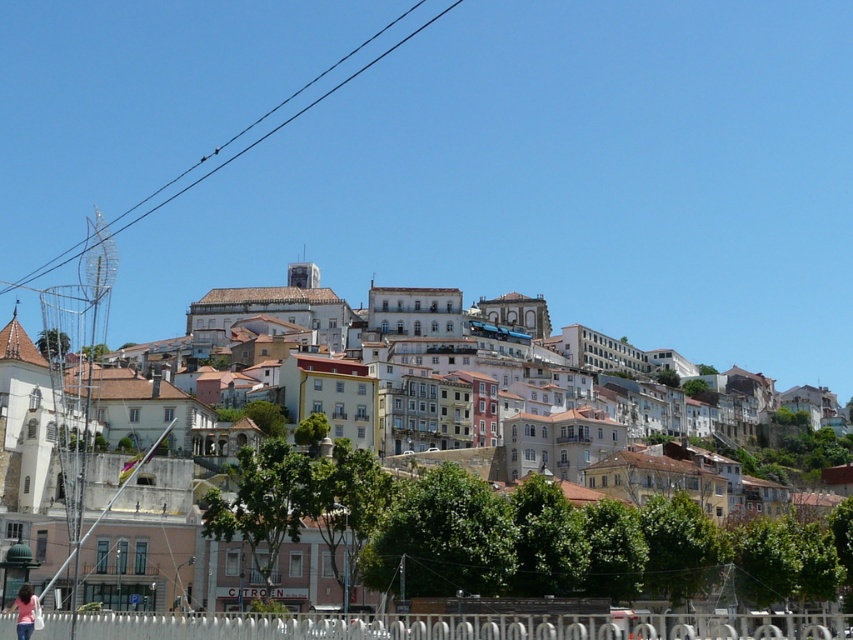
Is white stucco buildings at center to the right of black wire at upper center from the viewer's perspective?

Correct, you'll find white stucco buildings at center to the right of black wire at upper center.

Between white stucco buildings at center and black wire at upper center, which one appears on the left side from the viewer's perspective?

From the viewer's perspective, black wire at upper center appears more on the left side.

Between point (509, 550) and point (219, 168), which one is positioned behind?

The point (219, 168) is behind.

Find the location of a particular element. This screenshot has width=853, height=640. white stucco buildings at center is located at coordinates (519, 534).

Which is below, white stucco buildings at center or light blue jeans at lower left?

light blue jeans at lower left is below.

Who is more forward, (x=555, y=568) or (x=27, y=611)?

Point (x=27, y=611)

Is point (827, 534) positioned after point (22, 589)?

Yes, point (827, 534) is behind point (22, 589).

You are a GUI agent. You are given a task and a screenshot of the screen. Output one action in this format:
    pyautogui.click(x=<x>, y=<y>)
    Task: Click on the white stucco buildings at center
    The width and height of the screenshot is (853, 640).
    Given the screenshot: What is the action you would take?
    pyautogui.click(x=519, y=534)

Is black wire at upper center in front of light blue jeans at lower left?

No.

Who is lower down, black wire at upper center or light blue jeans at lower left?

light blue jeans at lower left

Which is in front, point (151, 208) or point (18, 593)?

Positioned in front is point (18, 593).

Locate an element on the screen. This screenshot has height=640, width=853. black wire at upper center is located at coordinates (289, 116).